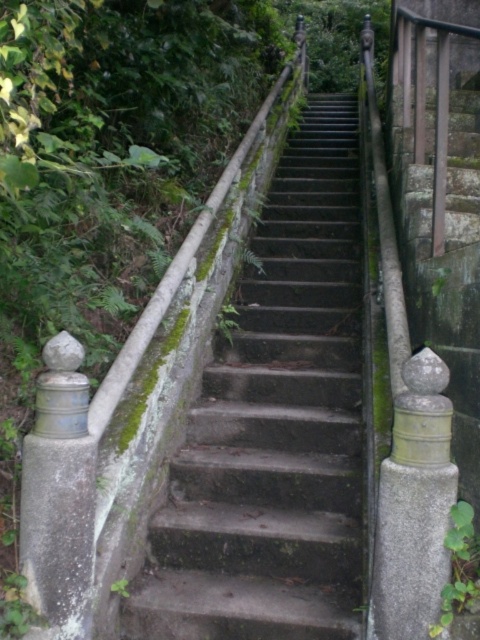
In the scene shown: You are a painter who needs to paint both the concrete stairs at center and the green mossy wall at upper left. Which object requires more paint because it has a larger surface area?

The concrete stairs at center requires more paint because it has a larger surface area than the green mossy wall at upper left.

You are a hiker who wants to climb up the concrete stairs at center. There is a green mossy wall at upper left in your view. Which object is closer to you as you stand at the bottom of the stairs?

The concrete stairs at center are closer to you than the green mossy wall at upper left because the green mossy wall at upper left is positioned behind the concrete stairs at center.

You are a painter who needs to decide whether to bring a large ladder or a smaller one. The concrete stairs at center and the green mossy wall at upper left are in your view. Which object would require the ladder if you need to paint the wider surface?

The concrete stairs at center might be wider than green mossy wall at upper left, so you should bring the large ladder to paint the concrete stairs at center.